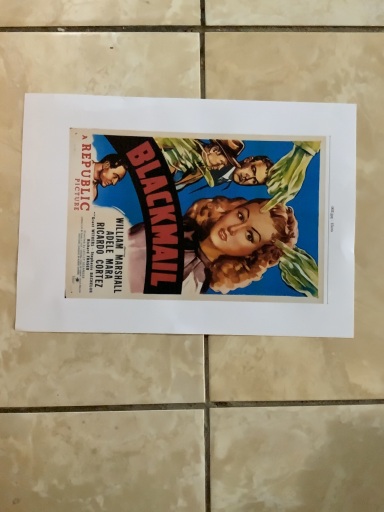
You are a GUI agent. You are given a task and a screenshot of the screen. Output one action in this format:
    pyautogui.click(x=<x>, y=<y>)
    Task: Click on the matte paper poster at center
    The height and width of the screenshot is (512, 384).
    Given the screenshot: What is the action you would take?
    pyautogui.click(x=186, y=216)

This screenshot has height=512, width=384. Describe the element at coordinates (186, 216) in the screenshot. I see `matte paper poster at center` at that location.

At what (x,y) coordinates should I click in order to perform the action: click on matte paper poster at center. Please return your answer as a coordinate pair (x, y). This screenshot has width=384, height=512. Looking at the image, I should click on (186, 216).